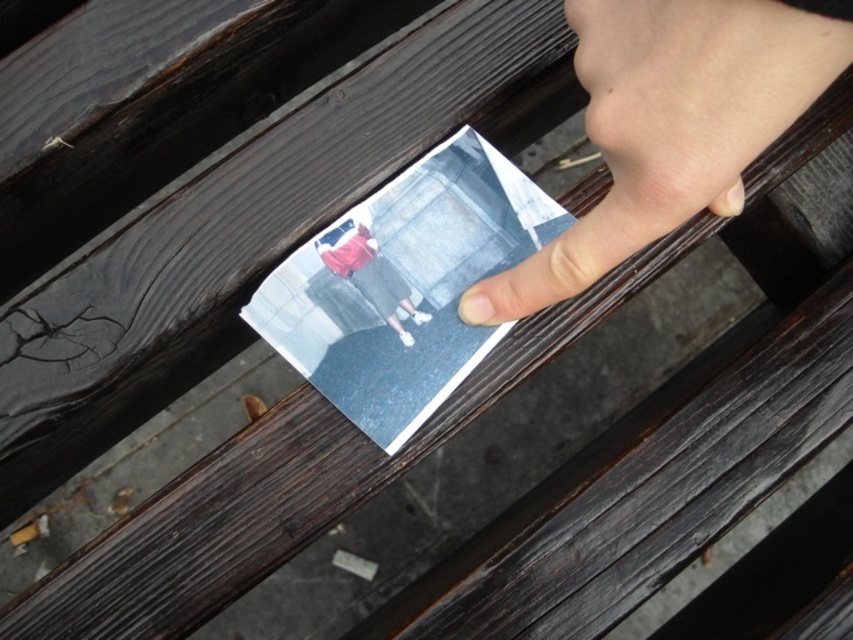
Question: Is pale skin at upper right below matte paper postcard at center?

Choices:
 (A) yes
 (B) no

Answer: (B)

Question: Does matte paper postcard at center have a smaller size compared to matte red shirt at center?

Choices:
 (A) no
 (B) yes

Answer: (A)

Question: Which point appears farthest from the camera in this image?

Choices:
 (A) (619, 186)
 (B) (364, 241)
 (C) (405, 381)

Answer: (B)

Question: Which object is positioned farthest from the matte red shirt at center?

Choices:
 (A) pale skin at upper right
 (B) matte paper postcard at center

Answer: (A)

Question: Does pale skin at upper right appear over matte paper postcard at center?

Choices:
 (A) no
 (B) yes

Answer: (B)

Question: Estimate the real-world distances between objects in this image. Which object is farther from the pale skin at upper right?

Choices:
 (A) matte paper postcard at center
 (B) matte red shirt at center

Answer: (B)